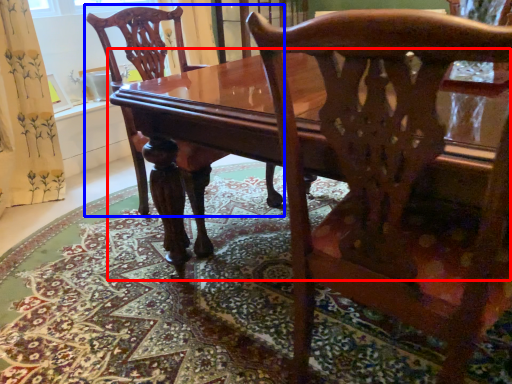
Question: Among these objects, which one is nearest to the camera, table (highlighted by a red box) or chair (highlighted by a blue box)?

Choices:
 (A) table
 (B) chair

Answer: (A)